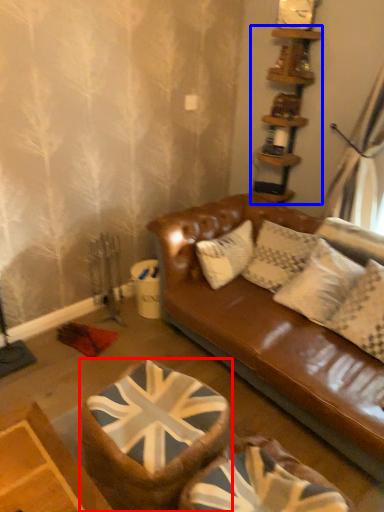
Question: Among these objects, which one is farthest to the camera, swivel chair (highlighted by a red box) or shelf (highlighted by a blue box)?

Choices:
 (A) swivel chair
 (B) shelf

Answer: (B)